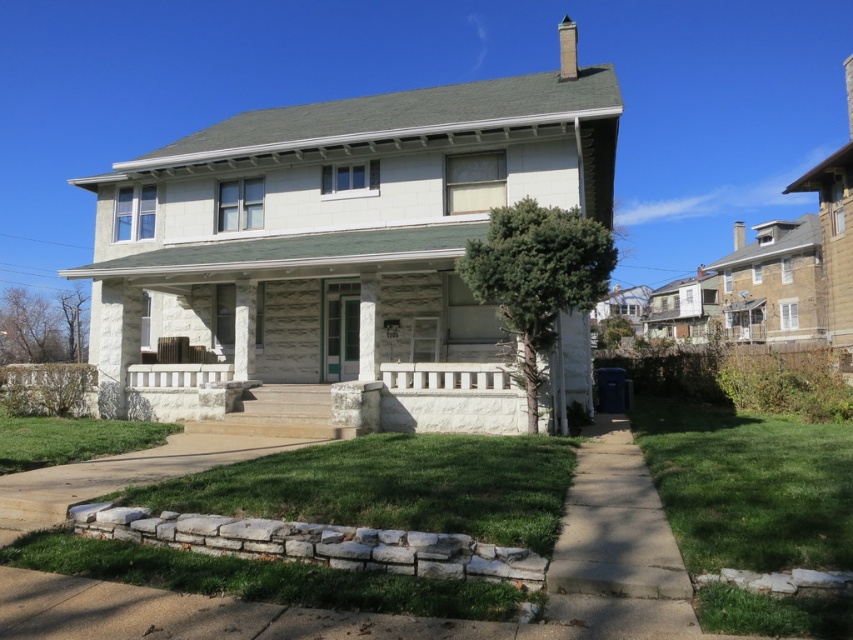
Does white stone porch at center have a lesser width compared to white stone column at center?

Incorrect, white stone porch at center's width is not less than white stone column at center's.

Does point (335, 412) lie behind point (367, 348)?

No.

Find the location of a particular element. Image resolution: width=853 pixels, height=640 pixels. white stone porch at center is located at coordinates (343, 397).